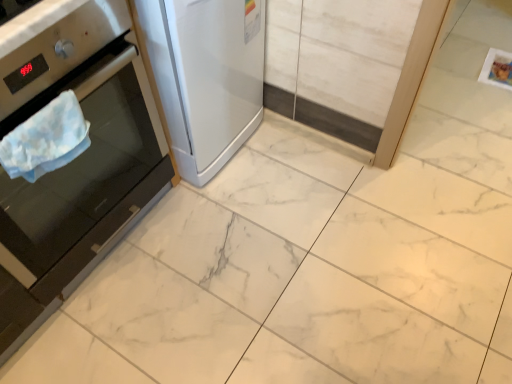
Question: Does point (160, 56) appear closer or farther from the camera than point (31, 119)?

Choices:
 (A) farther
 (B) closer

Answer: (A)

Question: Considering the positions of satin white refrigerator at left, arranged as the 1th home appliance when viewed from the right, and blue fabric towel at left in the image, is satin white refrigerator at left, arranged as the 1th home appliance when viewed from the right, taller or shorter than blue fabric towel at left?

Choices:
 (A) short
 (B) tall

Answer: (B)

Question: Which of these objects is positioned farthest from the satin white refrigerator at left, arranged as the 1th home appliance when viewed from the right?

Choices:
 (A) stainless steel oven at left, marked as the 1th home appliance in a left-to-right arrangement
 (B) blue fabric towel at left

Answer: (B)

Question: Which of these objects is positioned farthest from the blue fabric towel at left?

Choices:
 (A) stainless steel oven at left, marked as the 1th home appliance in a left-to-right arrangement
 (B) satin white refrigerator at left, the 2th home appliance when ordered from left to right

Answer: (B)